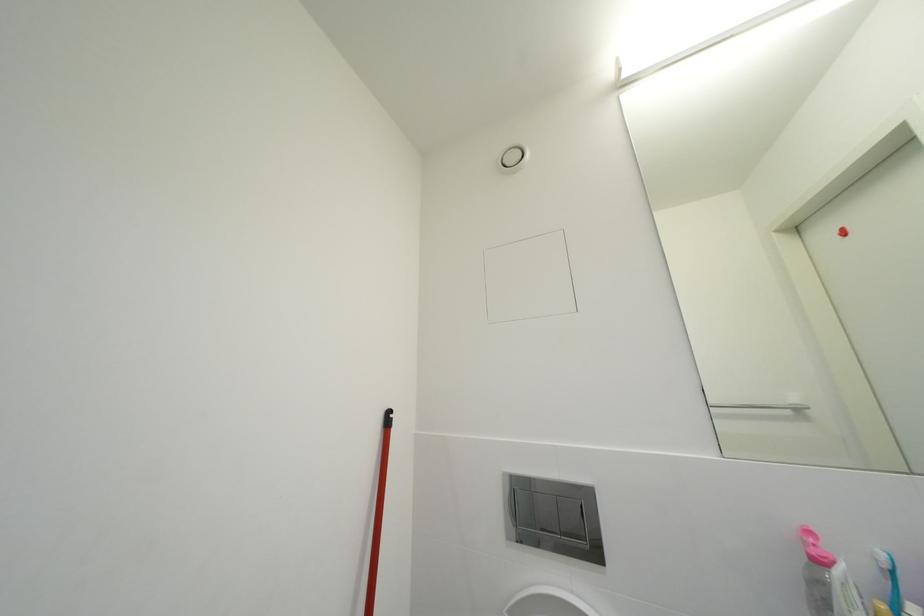
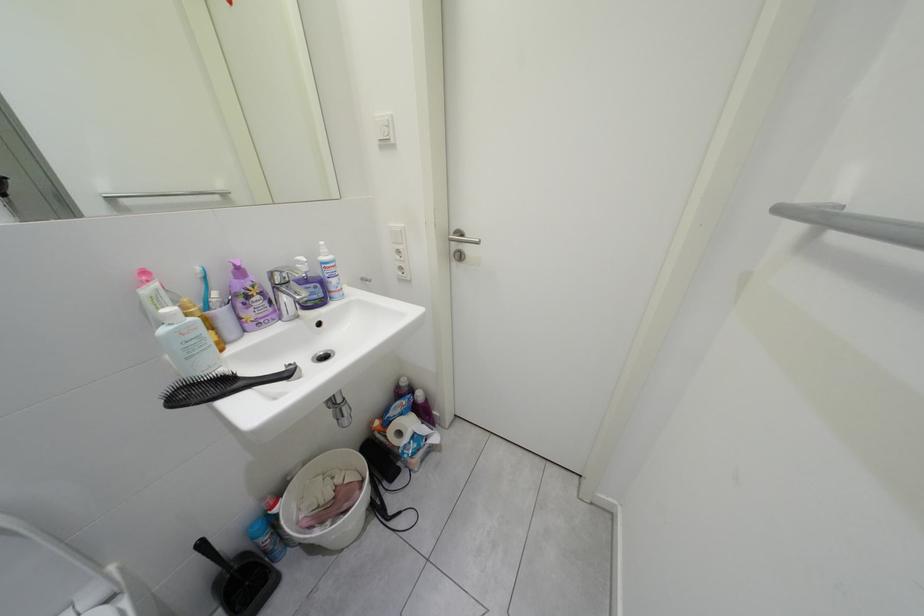
How did the camera likely rotate?

The camera rotated toward right-down.